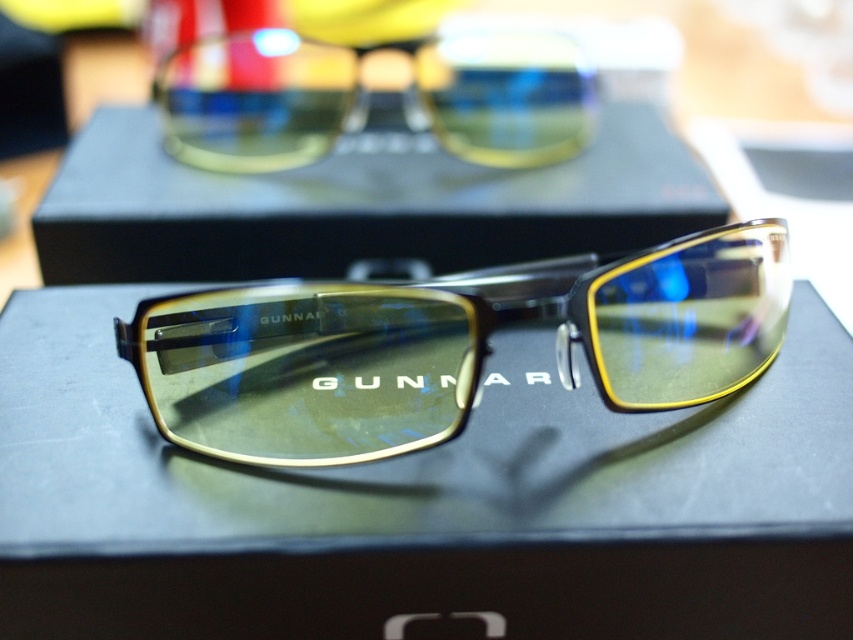
You are trying to determine if the matte gold frame at center will fit into a storage compartment designed for items narrower than the black matte box at center. Based on the scene, will it fit?

The matte gold frame at center has a lesser width compared to the black matte box at center, so it will fit into the storage compartment designed for items narrower than the black matte box at center.